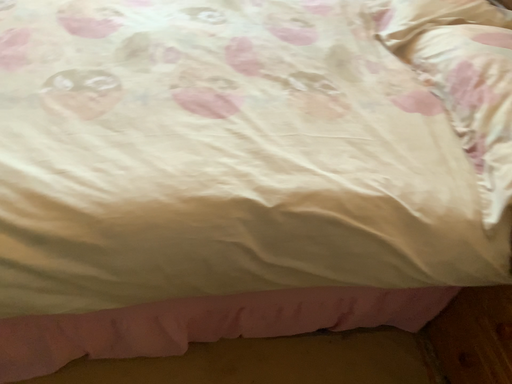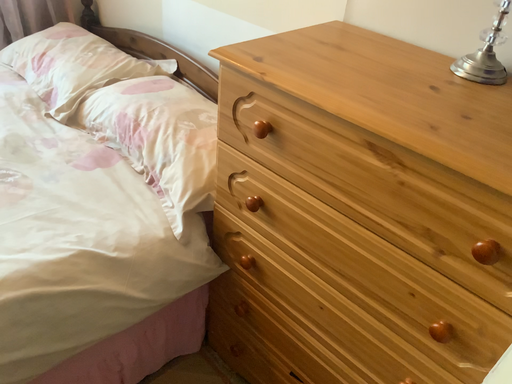
Question: Which way did the camera rotate in the video?

Choices:
 (A) rotated left
 (B) rotated right

Answer: (B)